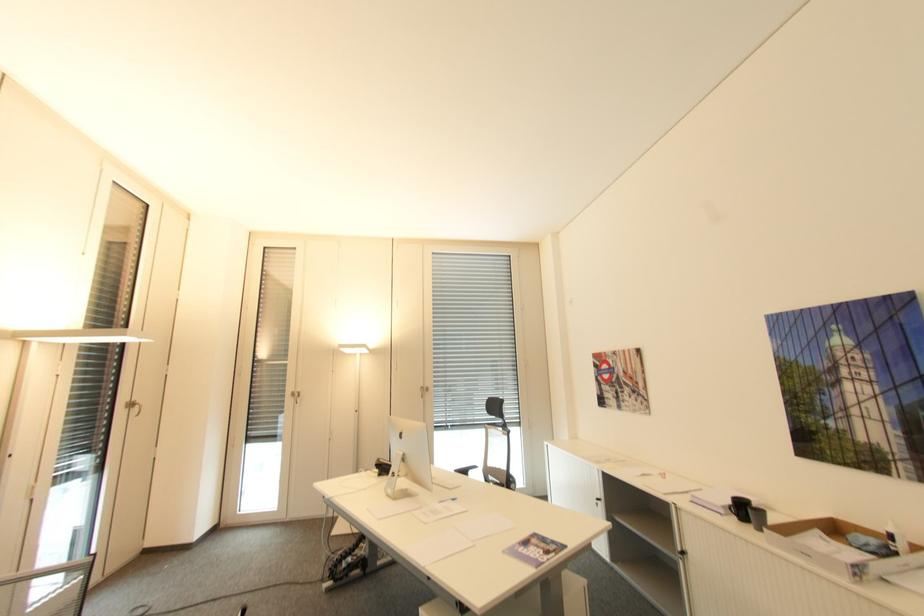
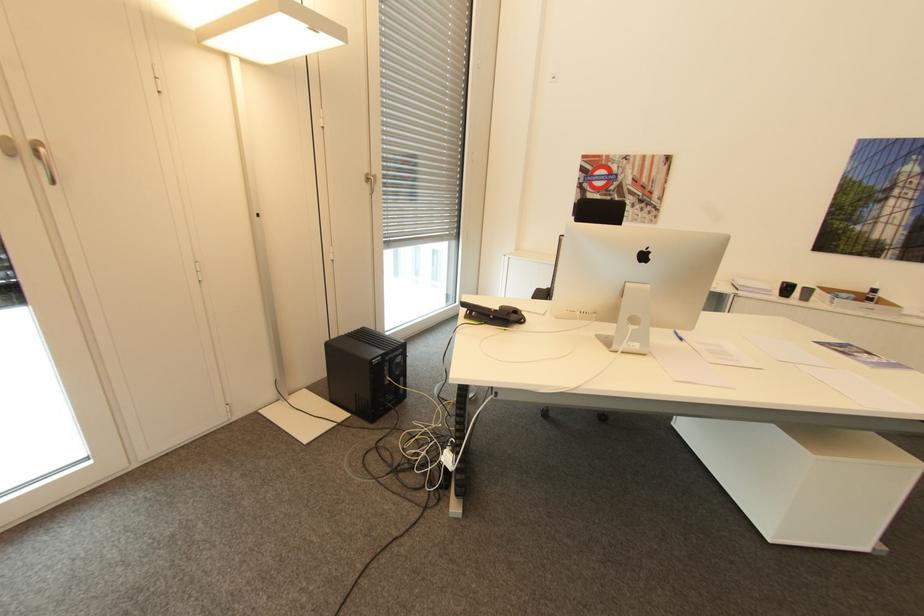
The point at (x=895, y=537) is marked in the first image. Where is the corresponding point in the second image?

(879, 290)